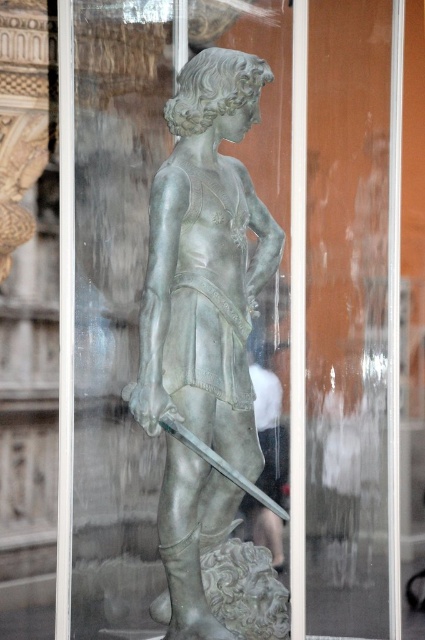
Which of these two, shiny bronze statue at center or polished silver sword at center, stands shorter?

polished silver sword at center

Between point (203, 330) and point (269, 497), which one is positioned in front?

Point (203, 330) is more forward.

Is point (204, 225) positioned before point (218, 454)?

No, (204, 225) is behind (218, 454).

Identify the location of shiny bronze statue at center. The height and width of the screenshot is (640, 425). [x=206, y=262].